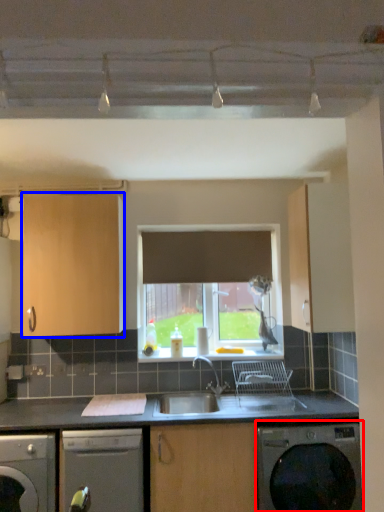
Question: Which of the following is the closest to the observer, washing machine (highlighted by a red box) or cabinetry (highlighted by a blue box)?

Choices:
 (A) washing machine
 (B) cabinetry

Answer: (A)